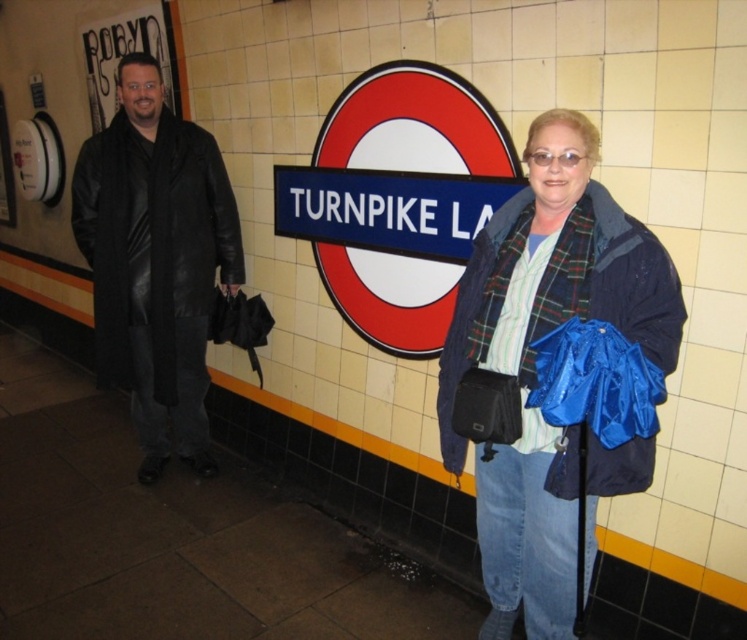
You are a photographer trying to capture the blue plaid scarf at center in the image. The camera is set to focus on the point at coordinates point (x=557, y=268). Will this point be effective for focusing on the blue plaid scarf at center?

Yes, the point (x=557, y=268) is effective for focusing on the blue plaid scarf at center because it directly indicates the location of the scarf.